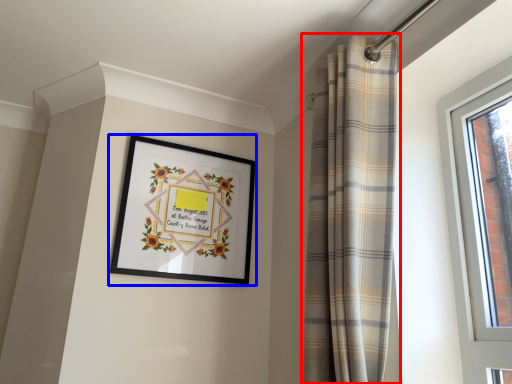
Question: Which of the following is the closest to the observer, curtain (highlighted by a red box) or picture frame (highlighted by a blue box)?

Choices:
 (A) curtain
 (B) picture frame

Answer: (A)